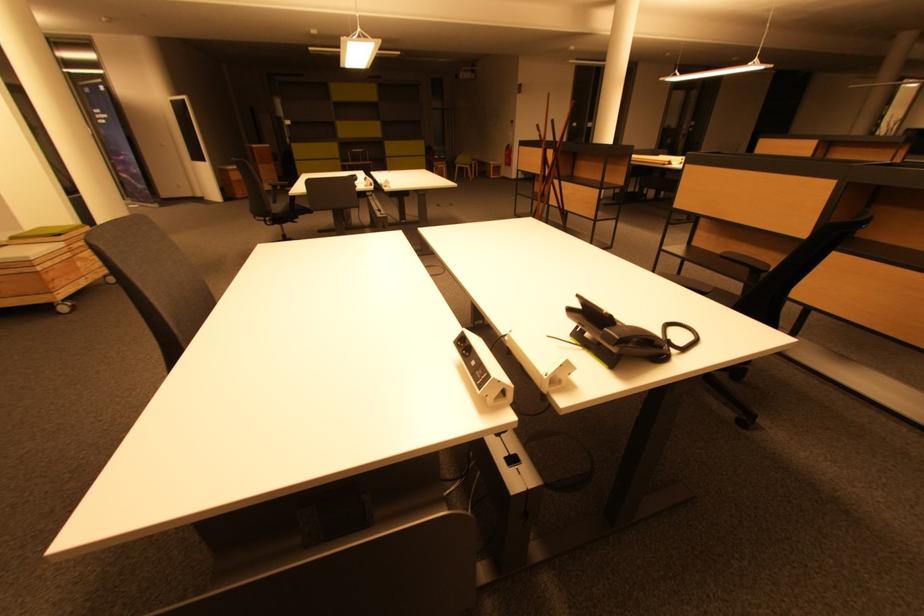
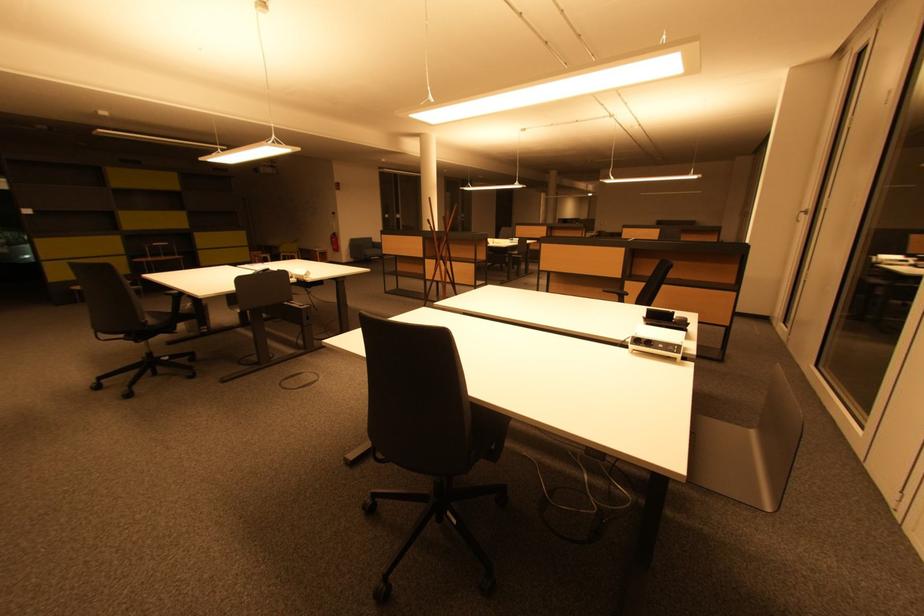
In the second image, find the point that corresponds to point (512, 155) in the first image.

(338, 241)